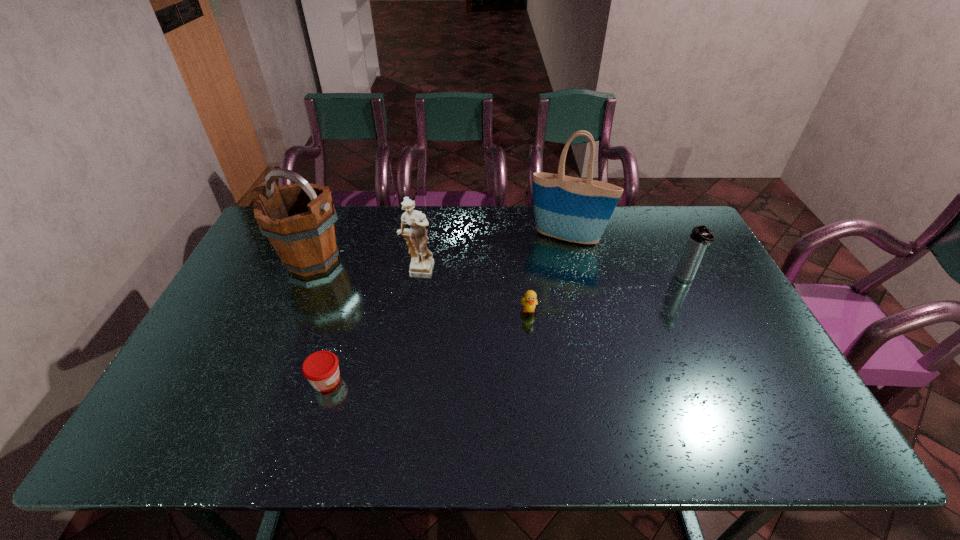
Locate an element on the screen. object present at the far left corner is located at coordinates click(x=299, y=219).

Identify the location of vacant space at the far edge of the desktop. Image resolution: width=960 pixels, height=540 pixels. (383, 208).

Where is `free region at the near edge of the desktop`? free region at the near edge of the desktop is located at coordinates (303, 427).

The width and height of the screenshot is (960, 540). In the image, there is a desktop. Find the location of `free region at the left edge`. free region at the left edge is located at coordinates (195, 388).

This screenshot has height=540, width=960. I want to click on vacant space at the right edge of the desktop, so click(706, 280).

The width and height of the screenshot is (960, 540). Identify the location of blank space at the far right corner of the desktop. (674, 226).

This screenshot has width=960, height=540. In order to click on empty space that is in between the leftmost object and the thermos bottle in this screenshot , I will do `click(498, 270)`.

Find the location of a particular element. This screenshot has width=960, height=540. free space between the nearest object and the duckling is located at coordinates (427, 346).

Locate an element on the screen. Image resolution: width=960 pixels, height=540 pixels. free space between the tote bag and the bucket is located at coordinates (441, 249).

I want to click on empty space between the figurine and the nearest object, so click(372, 327).